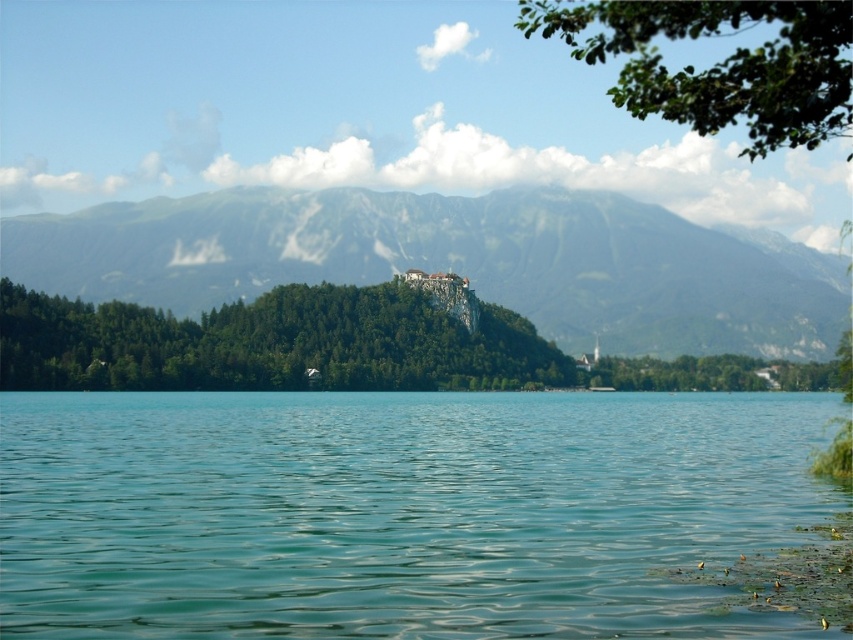
Question: Considering the real-world distances, which object is closest to the green leafy tree at center?

Choices:
 (A) green rocky mountain at center
 (B) green leafy branch at upper right

Answer: (A)

Question: Can you confirm if green rocky mountain at center is thinner than green leafy tree at center?

Choices:
 (A) yes
 (B) no

Answer: (B)

Question: Which of the following is the closest to the observer?

Choices:
 (A) green leafy branch at upper right
 (B) green leafy tree at center
 (C) green rocky mountain at center

Answer: (A)

Question: Which point is closer to the camera?

Choices:
 (A) (703, 314)
 (B) (177, 500)
 (C) (582, 54)

Answer: (B)

Question: Is green rocky mountain at center positioned at the back of green leafy tree at center?

Choices:
 (A) yes
 (B) no

Answer: (A)

Question: Can you confirm if clear water at center is positioned above green leafy tree at center?

Choices:
 (A) no
 (B) yes

Answer: (A)